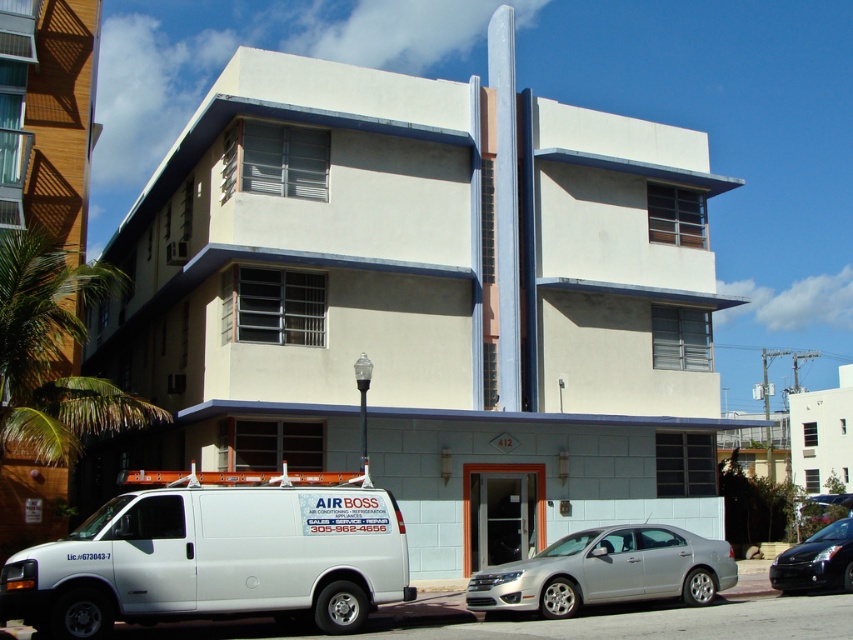
Question: Based on their relative distances, which object is farther from the white matte van at lower left?

Choices:
 (A) silver metallic sedan at center
 (B) shiny black sedan at lower right

Answer: (B)

Question: Can you confirm if silver metallic sedan at center is thinner than shiny black sedan at lower right?

Choices:
 (A) yes
 (B) no

Answer: (B)

Question: Does silver metallic sedan at center have a larger size compared to shiny black sedan at lower right?

Choices:
 (A) no
 (B) yes

Answer: (A)

Question: Where is white matte van at lower left located in relation to shiny black sedan at lower right in the image?

Choices:
 (A) below
 (B) above

Answer: (B)

Question: Which of the following is the closest to the observer?

Choices:
 (A) (572, 556)
 (B) (817, 564)
 (C) (138, 499)

Answer: (C)

Question: Which point appears closest to the camera in this image?

Choices:
 (A) (802, 572)
 (B) (138, 572)
 (C) (624, 582)

Answer: (B)